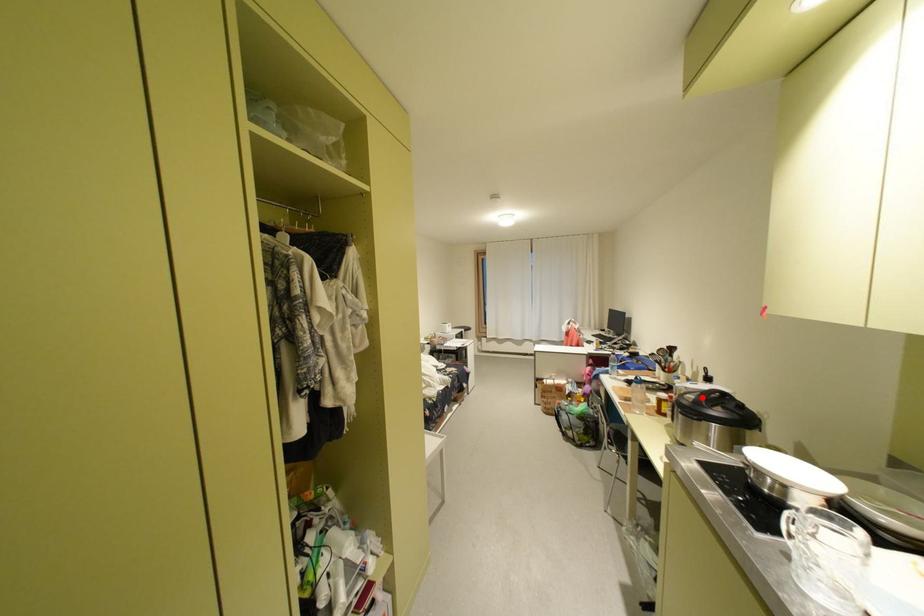
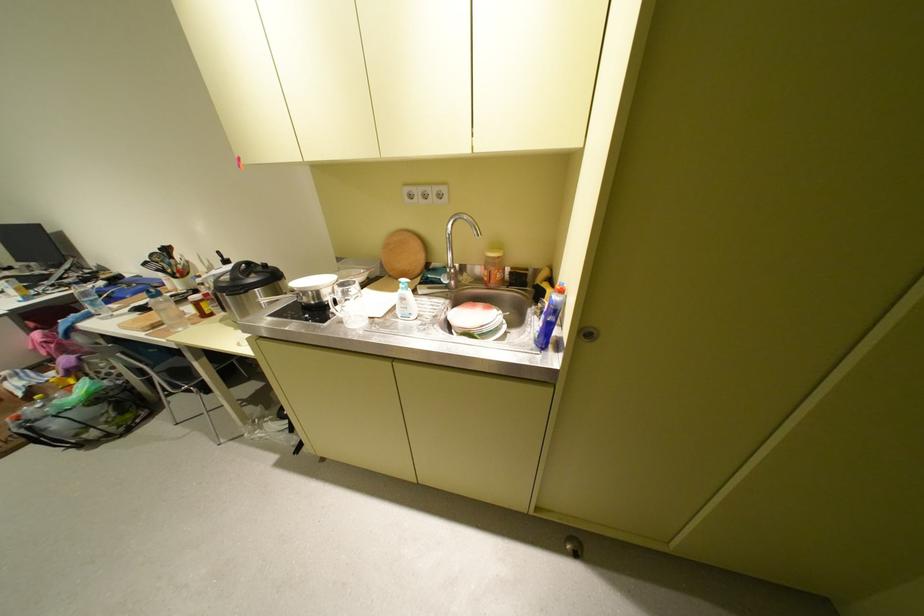
Locate, in the second image, the point that corresponds to the highlighted location in the first image.

(237, 277)